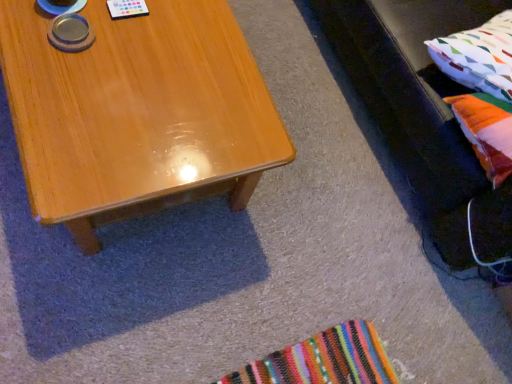
The width and height of the screenshot is (512, 384). Identify the location of free spot above shiny wood coffee table at center (from a real-world perspective). (133, 67).